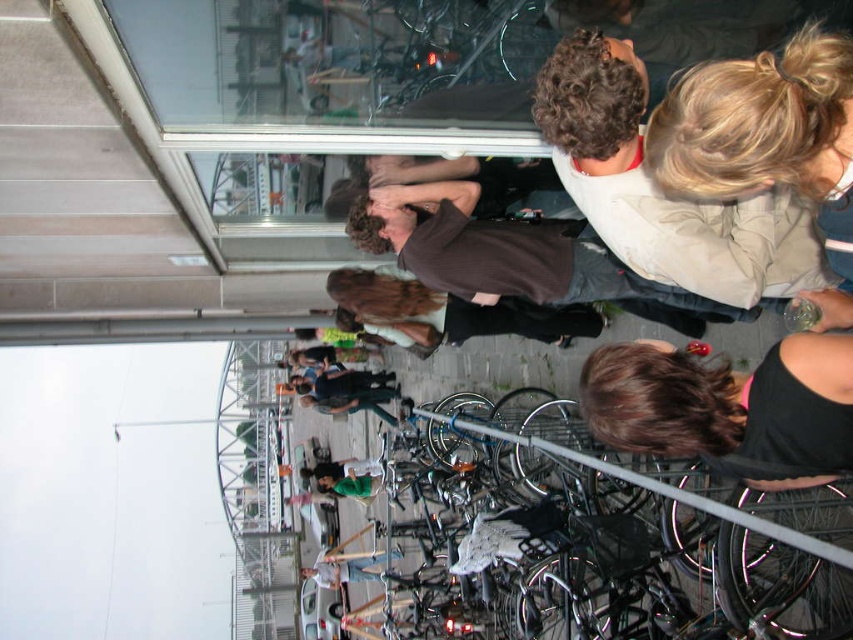
You are a fashion designer observing the image. You notice the black fabric at lower right and the brown matte shirt at upper center. Which of these two items has a narrower width?

The black fabric at lower right has a lesser width compared to the brown matte shirt at upper center, so the black fabric at lower right is narrower in width.